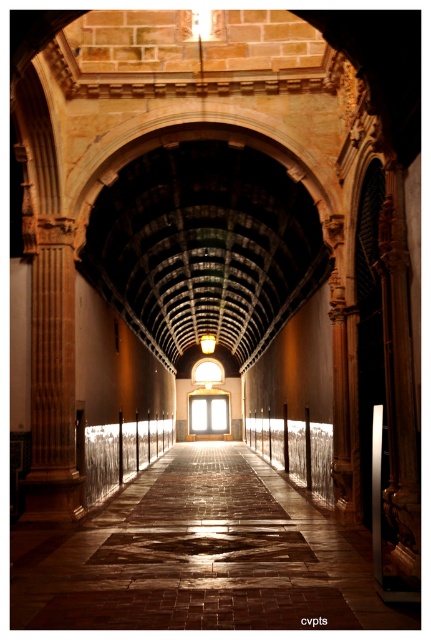
You are a tour guide leading a group through this historical corridor. You need to mention both the brown stone floor at center and the silver metallic rail at center in your explanation. Which object is bigger in size?

The brown stone floor at center is larger in size than the silver metallic rail at center.

You are a visitor in this corridor and want to touch both the silver metallic rail at center and the clear glass rail at center. Which rail should you reach for first if you want to touch the one closer to you first?

The silver metallic rail at center is closer to you, so you should reach for it first before touching the clear glass rail at center which is behind it.

You are a painter who needs to place a 1.2 meter wide canvas between the wooden column at left and the silver metallic rail at center. Can you fit it there?

The wooden column at left is wider than the silver metallic rail at center. Therefore, the space between them may not be sufficient to accommodate a 1.2 meter wide canvas. You should measure the exact distance between them before deciding.